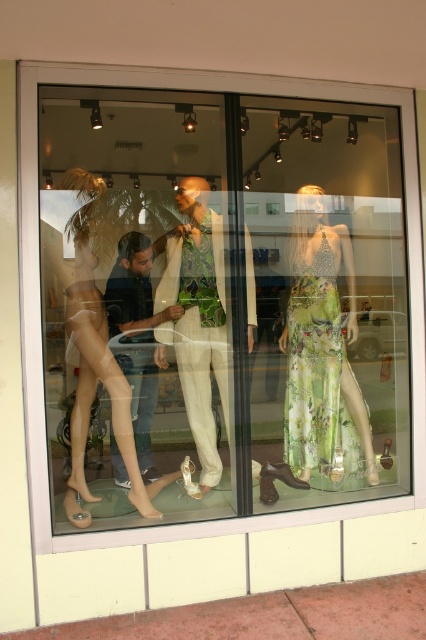
Which object is wider, the transparent plastic mannequin at center or the white fabric suit at center?

The transparent plastic mannequin at center is wider than the white fabric suit at center according to the description.

You are a window cleaner standing in front of the storefront. You need to clean the glass but want to avoid touching the transparent plastic mannequin at center and the translucent plastic dress at center. Which object should you clean around first, the taller one or the shorter one?

The transparent plastic mannequin at center is taller than the translucent plastic dress at center, so you should clean around the transparent plastic mannequin at center first as it is taller and might require more space to maneuver around.

You are a customer looking at the storefront window display. You see the white fabric suit at center and the translucent plastic dress at center. Which one is shorter in height?

The white fabric suit at center is shorter in height compared to the translucent plastic dress at center.